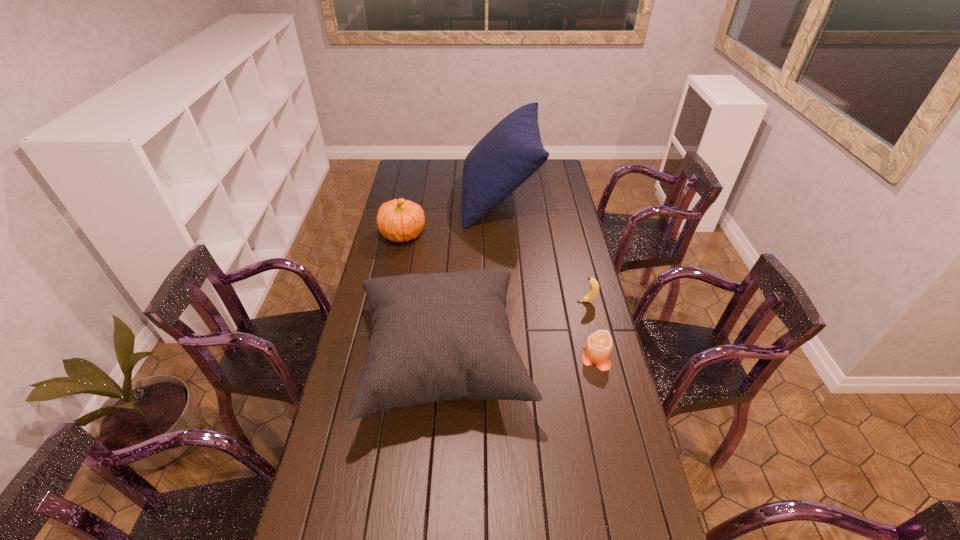
This screenshot has width=960, height=540. What are the coordinates of `object that ranks as the third closest to the banana` in the screenshot? It's located at (512, 151).

Where is `free space that satisfies the following two spatial constraints: 1. on the surface of the pumpkin; 2. on the left side of the candle`? free space that satisfies the following two spatial constraints: 1. on the surface of the pumpkin; 2. on the left side of the candle is located at coordinates (378, 357).

Where is `vacant area that satisfies the following two spatial constraints: 1. on the surface of the pumpkin; 2. on the right side of the candle`? This screenshot has width=960, height=540. vacant area that satisfies the following two spatial constraints: 1. on the surface of the pumpkin; 2. on the right side of the candle is located at coordinates (378, 357).

Locate an element on the screen. The width and height of the screenshot is (960, 540). vacant region that satisfies the following two spatial constraints: 1. on the surface of the third shortest object; 2. on the left side of the nearer cushion is located at coordinates (377, 362).

Locate an element on the screen. vacant space that satisfies the following two spatial constraints: 1. on the facing side of the farther cushion; 2. on the right side of the candle is located at coordinates (509, 357).